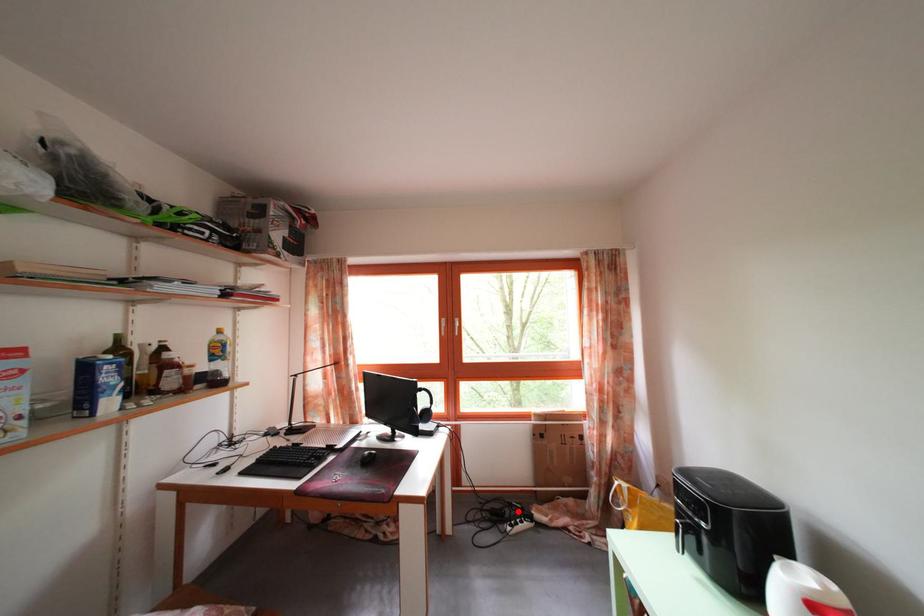
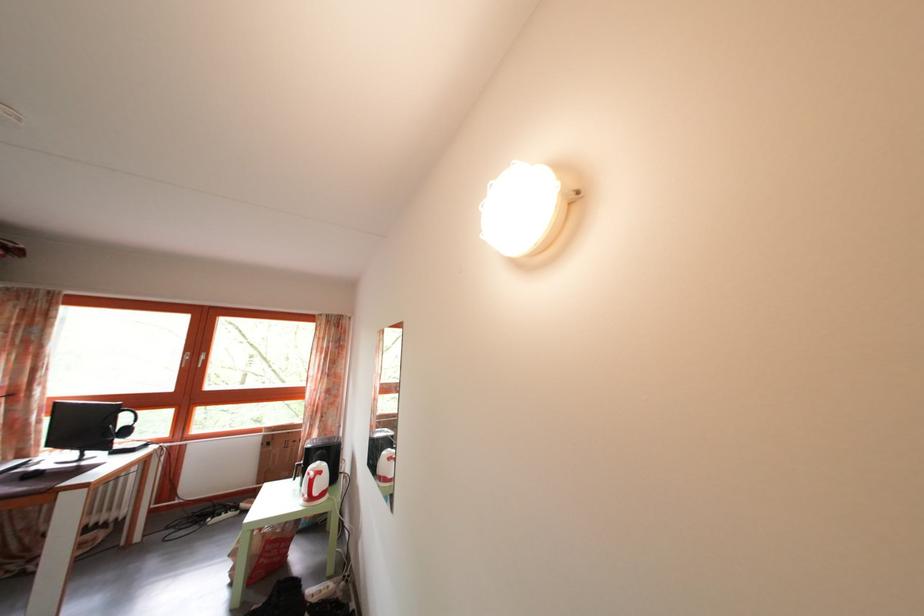
Question: A red point is marked in image1. In image2, is the corresponding 3D point closer to the camera or farther? Reply with the corresponding letter.

Choices:
 (A) The corresponding 3D point is closer.
 (B) The corresponding 3D point is farther.

Answer: (A)